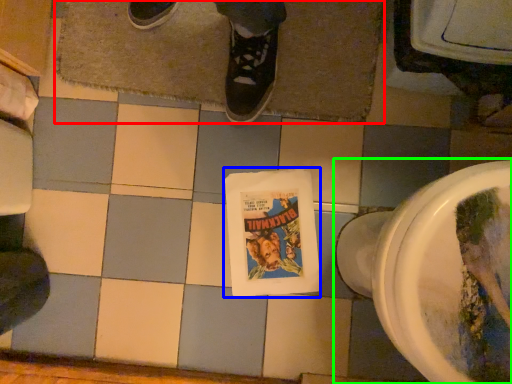
Question: Which object is the closest to the bath mat (highlighted by a red box)? Choose among these: comic book (highlighted by a blue box) or toilet (highlighted by a green box).

Choices:
 (A) comic book
 (B) toilet

Answer: (A)